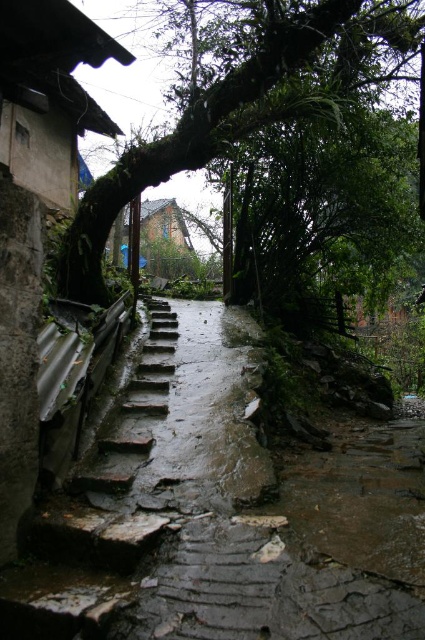
You are a hiker who wants to take a photo of the green mossy branch at upper center and the rusty stone stairs at left. Which object should you focus on first if you want to capture both in one frame without moving your camera?

The green mossy branch at upper center is bigger than the rusty stone stairs at left, so you should focus on the green mossy branch at upper center first to ensure it fills the frame appropriately before adjusting for the smaller stairs.

You are a painter wanting to capture the alleyway in your painting. You notice the green mossy branch at upper center and the rusty stone stairs at left. Which object has a greater width in the scene?

The green mossy branch at upper center has a greater width than the rusty stone stairs at left.